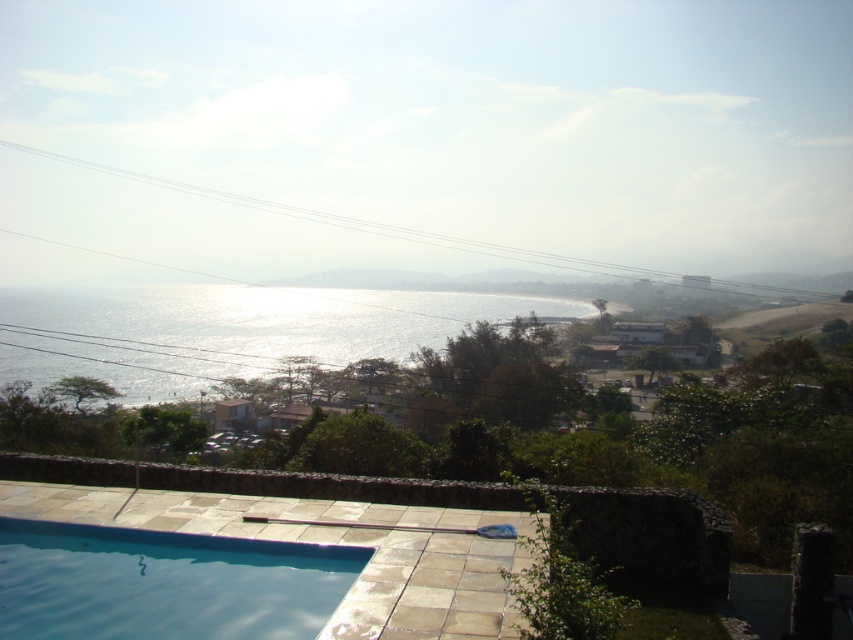
Question: Which of the following is the farthest from the observer?

Choices:
 (A) (183, 296)
 (B) (49, 529)

Answer: (A)

Question: Is the position of shiny metallic water at center more distant than that of clear glass pool at lower left?

Choices:
 (A) no
 (B) yes

Answer: (B)

Question: Is the position of shiny metallic water at center more distant than that of clear glass pool at lower left?

Choices:
 (A) no
 (B) yes

Answer: (B)

Question: Which point is farther from the camera taking this photo?

Choices:
 (A) (4, 326)
 (B) (51, 605)

Answer: (A)

Question: Can you confirm if shiny metallic water at center is wider than clear glass pool at lower left?

Choices:
 (A) no
 (B) yes

Answer: (B)